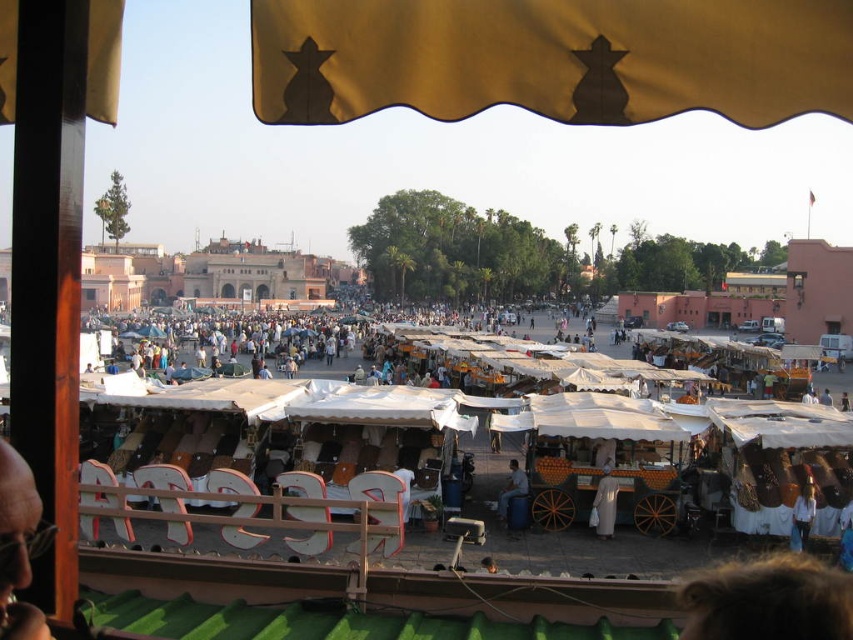
Question: Which object appears closest to the camera in this image?

Choices:
 (A) white cotton dress at center
 (B) gold fabric awning at upper center
 (C) light brown wooden cart at center
 (D) white cotton dress at lower right

Answer: (B)

Question: Is gold fabric awning at upper center above white cotton dress at center?

Choices:
 (A) no
 (B) yes

Answer: (B)

Question: Among these objects, which one is nearest to the camera?

Choices:
 (A) gold fabric awning at upper center
 (B) white cotton dress at lower right
 (C) light brown wooden cart at center

Answer: (A)

Question: In this image, where is white cotton dress at lower right located relative to light brown wooden cart at center?

Choices:
 (A) above
 (B) below

Answer: (A)

Question: Can you confirm if white cotton dress at lower right is positioned to the left of light brown wooden cart at center?

Choices:
 (A) yes
 (B) no

Answer: (B)

Question: Which object appears closest to the camera in this image?

Choices:
 (A) white cotton dress at center
 (B) white cotton dress at lower right

Answer: (B)